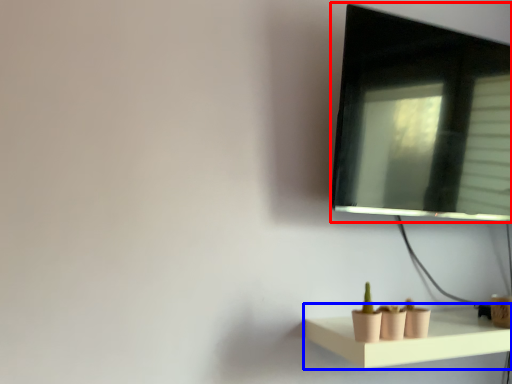
Question: Which of the following is the closest to the observer, computer monitor (highlighted by a red box) or shelf (highlighted by a blue box)?

Choices:
 (A) computer monitor
 (B) shelf

Answer: (B)